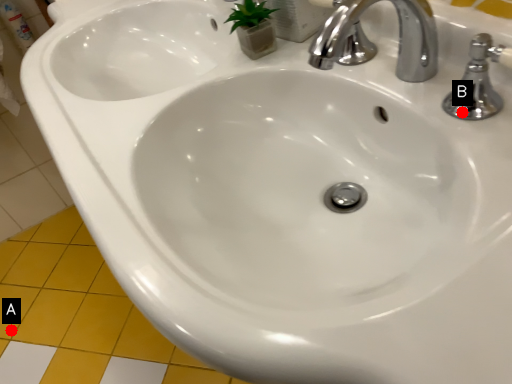
Question: Two points are circled on the image, labeled by A and B beside each circle. Among these points, which one is farthest from the camera?

Choices:
 (A) A is further
 (B) B is further

Answer: (A)